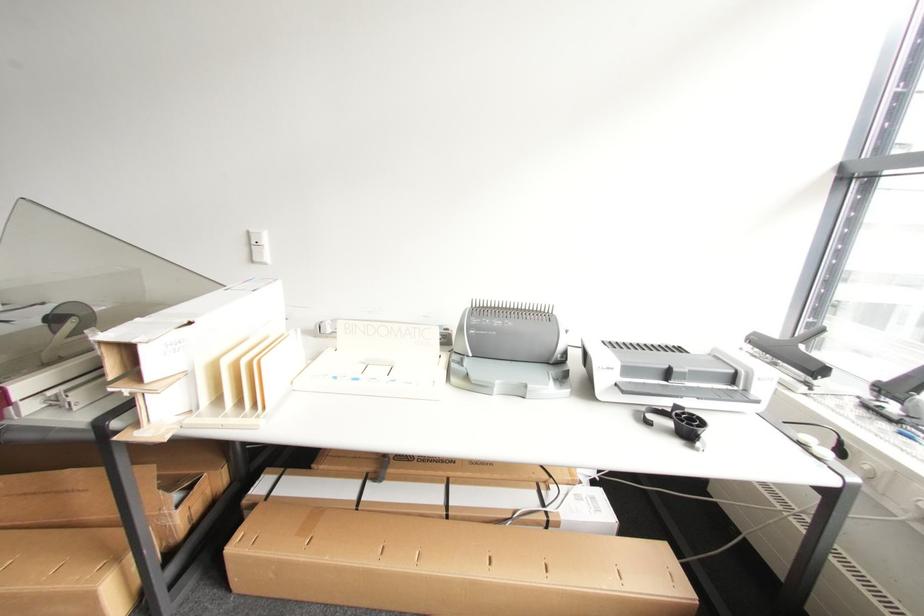
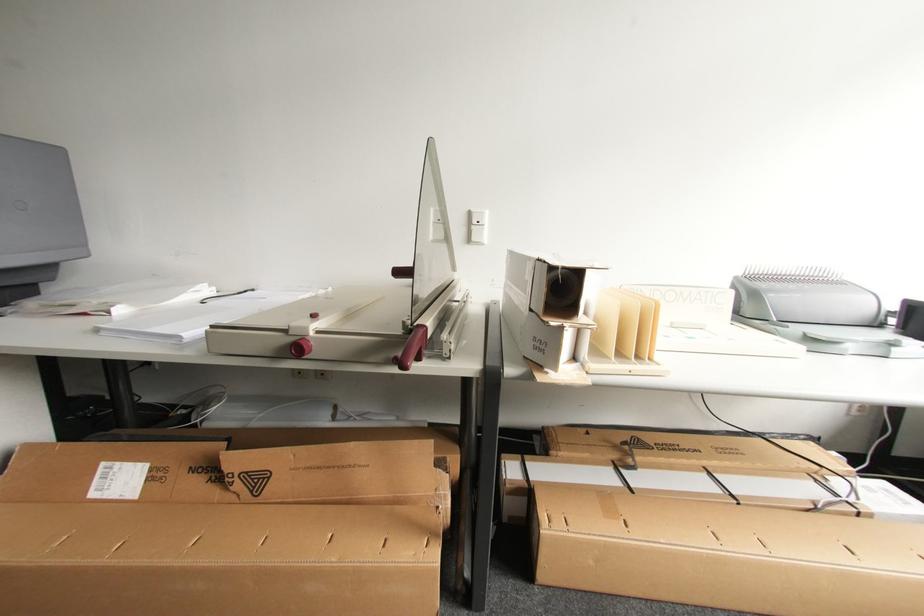
Question: What movement of the cameraman would produce the second image?

Choices:
 (A) Left
 (B) Right
 (C) Forward
 (D) Backward

Answer: (A)